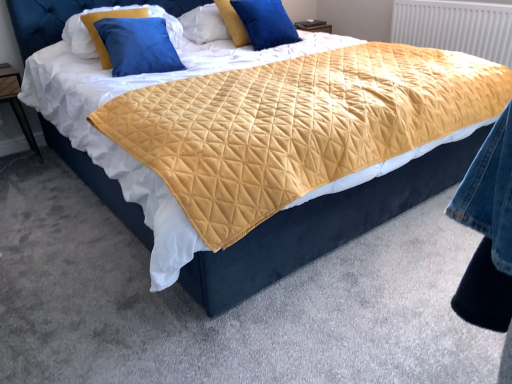
In order to click on vacant space in wooden nightstand at left (from a real-world perspective) in this screenshot , I will do `click(18, 152)`.